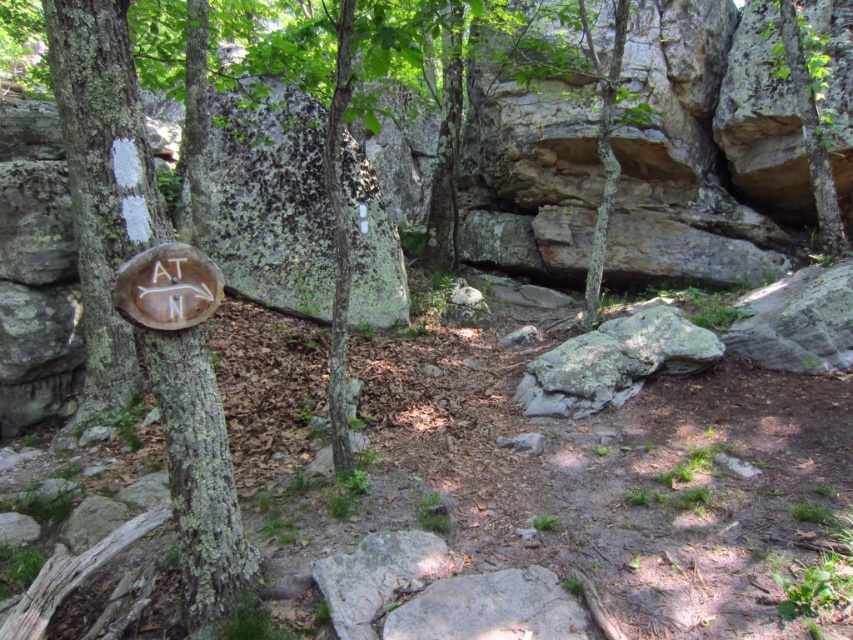
You are a hiker trying to follow the Appalachian Trail. You see two trees with green rough bark in the scene. One is labeled as green rough bark at left and the other as green rough bark tree at upper right. According to the trail markers, which direction should you head towards to continue on the correct path?

The green rough bark at left is to the left of the green rough bark tree at upper right. Since the Appalachian Trail markers usually indicate direction with symbols, you should head towards the green rough bark tree at upper right as it is positioned further along the path.

You are a hiker who just arrived at this forest area. You see the brown wood sign at left and the green rough bark tree at upper right. Which object is bigger in size?

The brown wood sign at left has a larger size compared to the green rough bark tree at upper right.

You are a hiker who just arrived at this trail marker. You need to know which object is bigger between the brown wood sign at left and the green rough bark at left. Can you tell me?

The brown wood sign at left has a larger size compared to the green rough bark at left, so the brown wood sign at left is bigger.